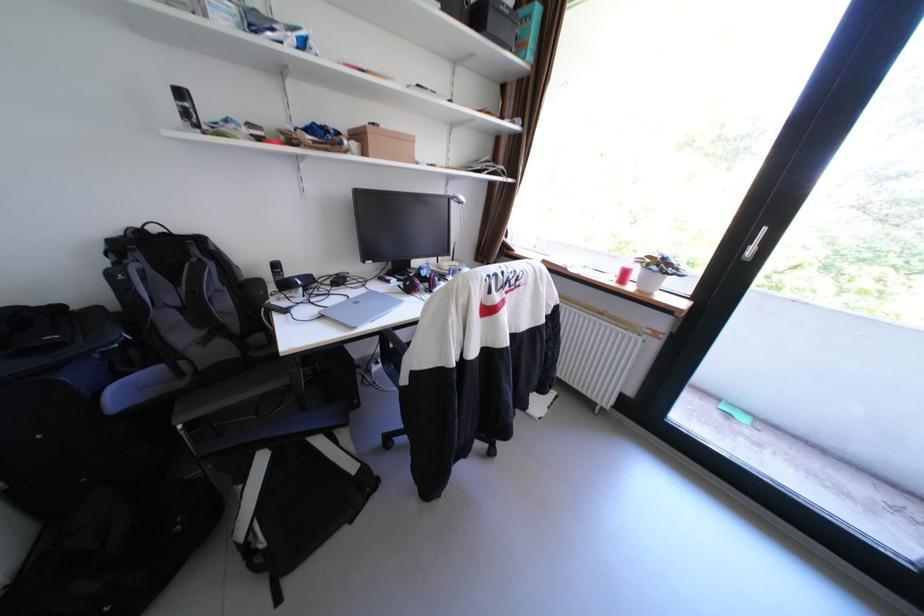
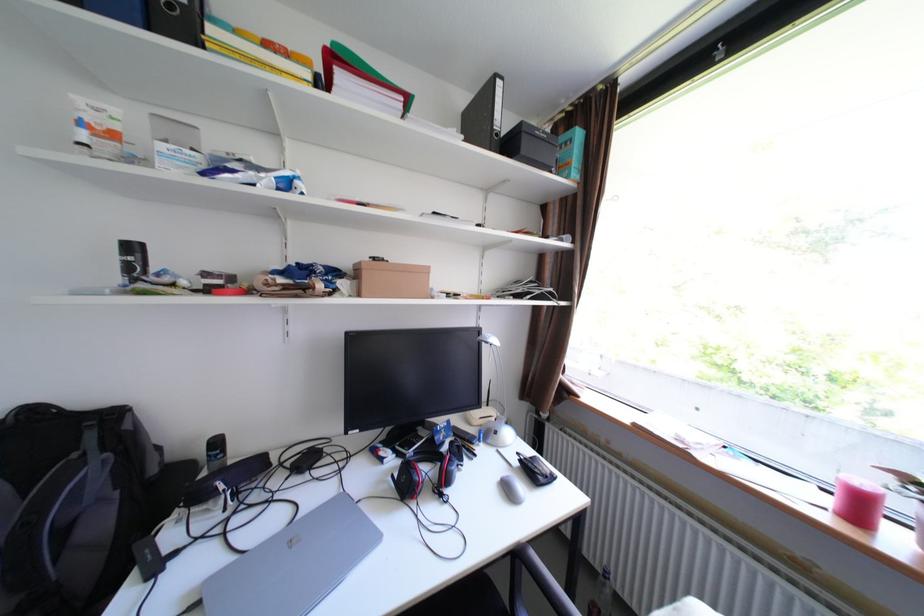
The point at (235, 304) is marked in the first image. Where is the corresponding point in the second image?

(110, 524)